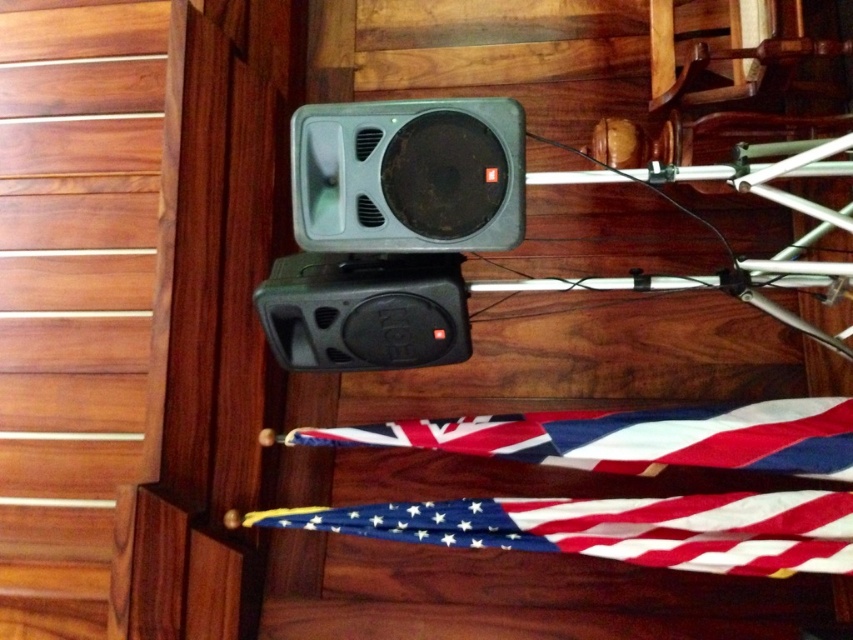
You are standing in front of the wooden table with the JBL speakers and the tripod. There are two points marked on the table surface at coordinates point (701,445) and point (396,314). Which point is closer to you?

Point (701,445) is further to the viewer than point (396,314), so the point closer to you is point (396,314).

You are setting up a display in a store and need to arrange items according to their sizes. You have a polyester flag at lower center and a black plastic speaker at center. Based on their sizes, which item should you place first if you want to start with the larger item?

The polyester flag at lower center is bigger than the black plastic speaker at center, so you should place the polyester flag at lower center first.

You are setting up a presentation and need to place a flag on the left side of the speaker. Based on the image, is the polyester flag at lower center currently positioned to the left or right of the black plastic speaker at center?

The polyester flag at lower center is to the right of the black plastic speaker at center, so it is not positioned to the left as required for the presentation setup.